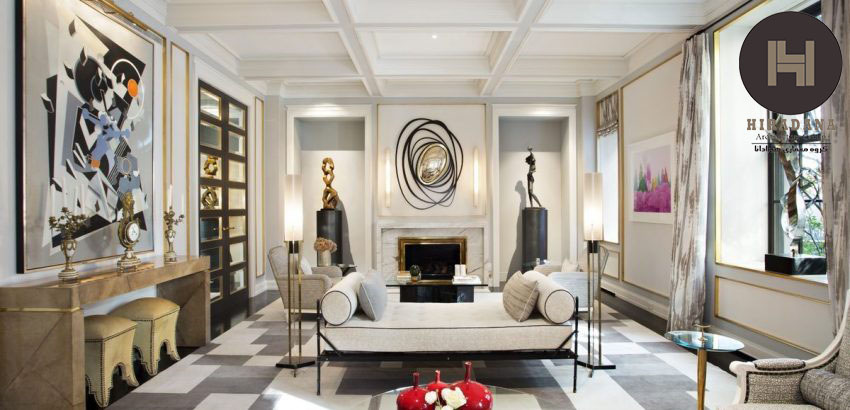
At what (x,y) coordinates should I click in order to perform the action: click on curtains. Please return your answer as a coordinate pair (x, y). This screenshot has height=410, width=850. Looking at the image, I should click on (689, 272), (831, 196).